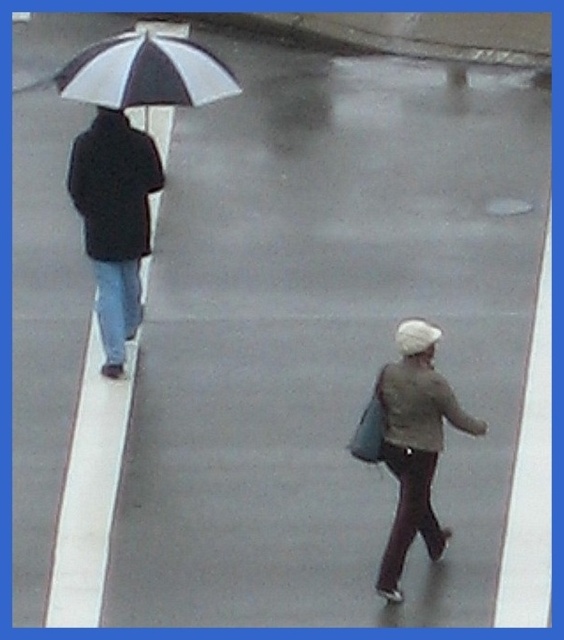
Is light brown fabric jacket at lower right to the left of white and black striped umbrella at upper left from the viewer's perspective?

In fact, light brown fabric jacket at lower right is to the right of white and black striped umbrella at upper left.

Who is positioned more to the right, light brown fabric jacket at lower right or white and black striped umbrella at upper left?

light brown fabric jacket at lower right is more to the right.

This screenshot has width=564, height=640. Find the location of `light brown fabric jacket at lower right`. light brown fabric jacket at lower right is located at coordinates (415, 444).